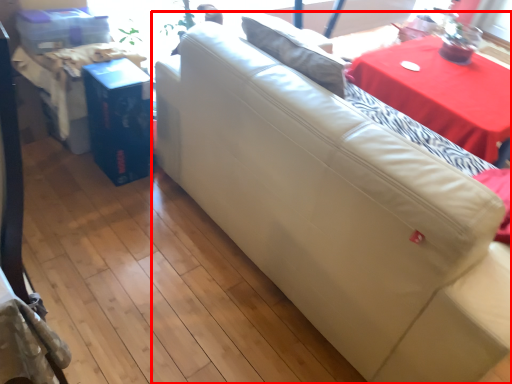
Question: Where is studio couch (annotated by the red box) located in relation to table in the image?

Choices:
 (A) right
 (B) left

Answer: (B)